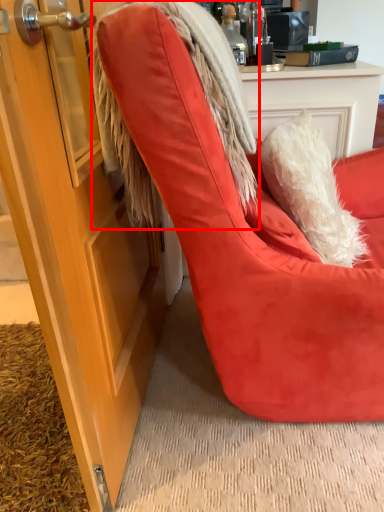
Question: Observing the image, what is the correct spatial positioning of fur coat (annotated by the red box) in reference to chair?

Choices:
 (A) right
 (B) left

Answer: (B)